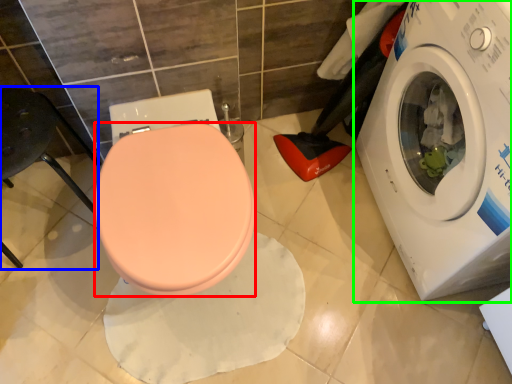
Question: Which object is the closest to the bidet (highlighted by a red box)? Choose among these: chair (highlighted by a blue box) or washing machine (highlighted by a green box).

Choices:
 (A) chair
 (B) washing machine

Answer: (A)